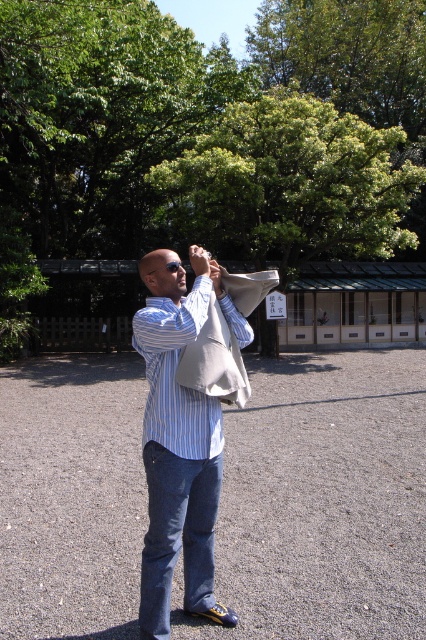
What is the exact coordinate of the denim at center?

The denim at center is located at point (178, 534).

You are a fashion designer observing a model wearing two shirts. The model is standing in a park with trees casting shadows. Which shirt, the matte blue shirt at center or the blue striped shirt at center, has a narrower width?

The matte blue shirt at center is thinner than the blue striped shirt at center, so the matte blue shirt at center has a narrower width.